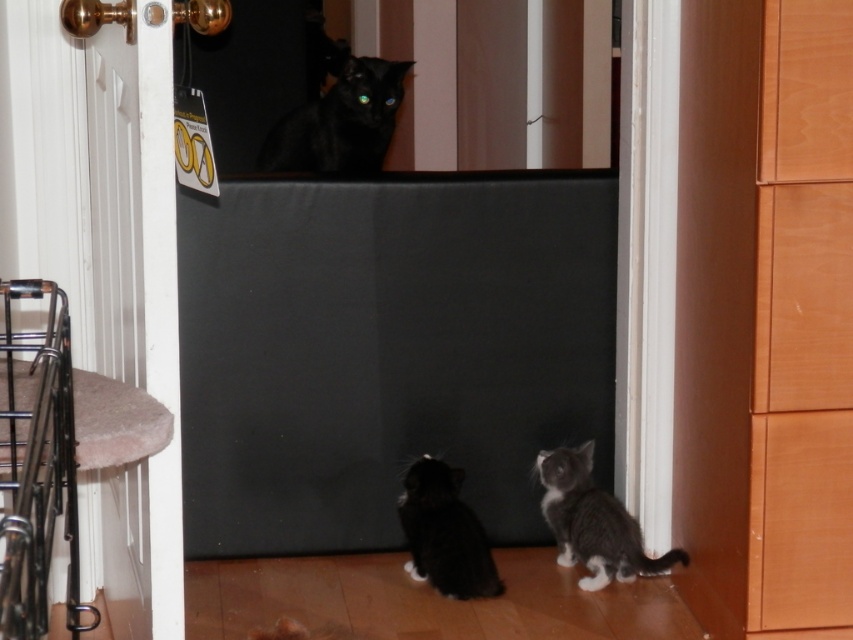
Is shiny black cat at upper center smaller than black fur cat at lower center?

No.

The width and height of the screenshot is (853, 640). Identify the location of shiny black cat at upper center. (339, 118).

Does gray fluffy kitten at lower right come behind black fur cat at lower center?

That is True.

Is gray fluffy kitten at lower right shorter than black fur cat at lower center?

No, gray fluffy kitten at lower right is not shorter than black fur cat at lower center.

Which is in front, point (616, 563) or point (445, 484)?

Point (445, 484) is in front.

Locate an element on the screen. The height and width of the screenshot is (640, 853). gray fluffy kitten at lower right is located at coordinates pyautogui.click(x=592, y=522).

Is shiny black cat at upper center wider than gray fluffy kitten at lower right?

Indeed, shiny black cat at upper center has a greater width compared to gray fluffy kitten at lower right.

Does shiny black cat at upper center have a lesser width compared to gray fluffy kitten at lower right?

Incorrect, shiny black cat at upper center's width is not less than gray fluffy kitten at lower right's.

Find the location of a particular element. The height and width of the screenshot is (640, 853). shiny black cat at upper center is located at coordinates pyautogui.click(x=339, y=118).

Locate an element on the screen. The image size is (853, 640). shiny black cat at upper center is located at coordinates (339, 118).